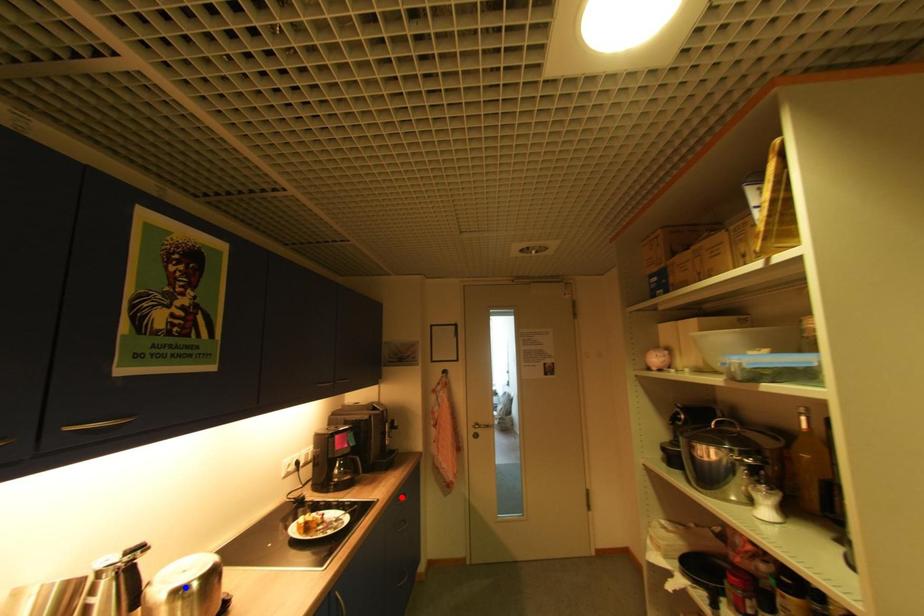
Question: Which of the two points in the image is closer to the camera?

Choices:
 (A) Blue point is closer.
 (B) Red point is closer.

Answer: (A)